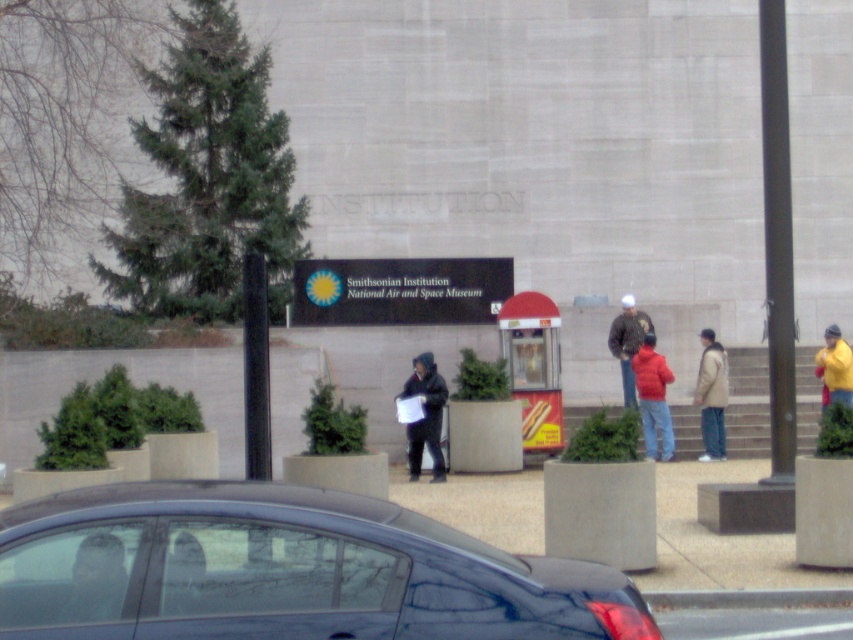
Question: Which point is closer to the camera?

Choices:
 (A) shiny black car at lower left
 (B) light brown leather jacket at lower left
 (C) matte red jacket at center
 (D) matte black jacket at center

Answer: (A)

Question: Does dark gray jacket at center have a smaller size compared to matte black jacket at center?

Choices:
 (A) no
 (B) yes

Answer: (A)

Question: Can you confirm if light brown leather jacket at lower left is positioned below light brown jacket at center?

Choices:
 (A) yes
 (B) no

Answer: (B)

Question: Which of the following is the farthest from the observer?

Choices:
 (A) light brown jacket at center
 (B) yellow matte jacket at upper right
 (C) dark gray jacket at center
 (D) matte red jacket at center

Answer: (A)

Question: Can you confirm if dark gray jacket at center is thinner than light brown jacket at center?

Choices:
 (A) yes
 (B) no

Answer: (B)

Question: Estimate the real-world distances between objects in this image. Which object is closer to the matte red jacket at center?

Choices:
 (A) matte black jacket at center
 (B) yellow matte jacket at upper right
 (C) light brown jacket at center
 (D) light brown leather jacket at lower left

Answer: (C)